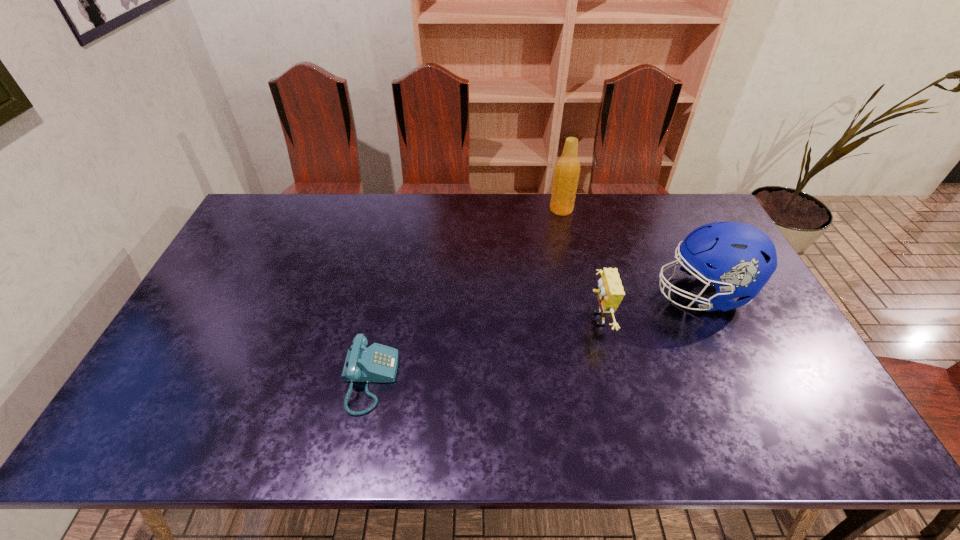
Locate an element on the screen. The height and width of the screenshot is (540, 960). vacant area that lies between the third tallest object and the shortest object is located at coordinates (484, 349).

Identify the location of vacant space that's between the third tallest object and the shortest object. This screenshot has height=540, width=960. (484, 349).

I want to click on free space between the beer bottle and the football helmet, so click(x=632, y=251).

This screenshot has height=540, width=960. I want to click on vacant area that lies between the third tallest object and the beer bottle, so pos(580,264).

Find the location of a particular element. vacant point located between the rightmost object and the beer bottle is located at coordinates (632, 251).

Where is `empty location between the football helmet and the beer bottle`? empty location between the football helmet and the beer bottle is located at coordinates (632, 251).

The height and width of the screenshot is (540, 960). What are the coordinates of `vacant area between the football helmet and the farthest object` in the screenshot? It's located at (632, 251).

In order to click on unoccupied area between the rightmost object and the farthest object in this screenshot , I will do `click(632, 251)`.

Image resolution: width=960 pixels, height=540 pixels. I want to click on free space that is in between the rightmost object and the shortest object, so click(x=536, y=336).

Identify the location of object identified as the second closest to the farthest object. (610, 293).